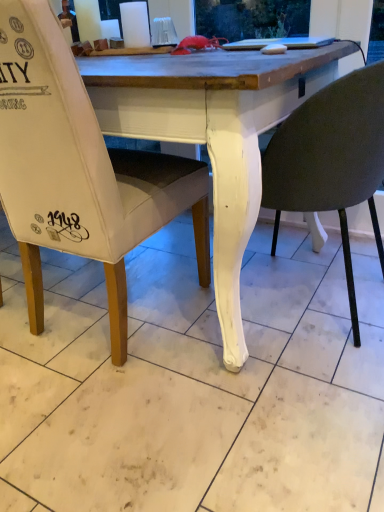
Where is `vacant area that is in front of white fabric chair at left, arranged as the second chair when viewed from the right`? The height and width of the screenshot is (512, 384). vacant area that is in front of white fabric chair at left, arranged as the second chair when viewed from the right is located at coordinates (137, 425).